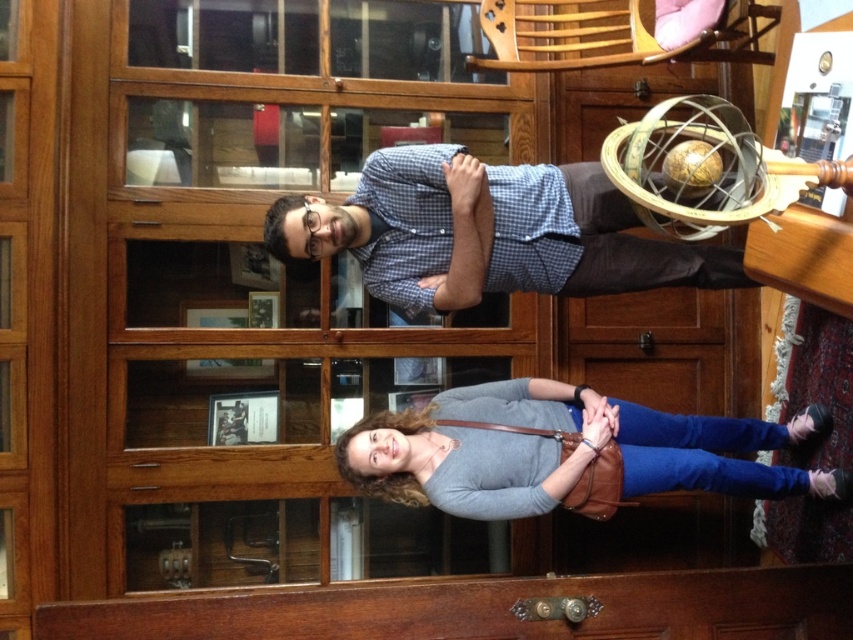
Which is behind, point (254, 381) or point (314, 243)?

Positioned behind is point (254, 381).

Does transparent wood glass door at upper center have a lesser height compared to blue checkered shirt at center?

In fact, transparent wood glass door at upper center may be taller than blue checkered shirt at center.

Is point (517, 362) closer to viewer compared to point (498, 273)?

No, (517, 362) is further to viewer.

Locate an element on the screen. transparent wood glass door at upper center is located at coordinates (260, 294).

The height and width of the screenshot is (640, 853). Find the location of `transparent wood glass door at upper center`. transparent wood glass door at upper center is located at coordinates (260, 294).

Can you confirm if transparent wood glass door at upper center is thinner than matte gray sweater at lower center?

Incorrect, transparent wood glass door at upper center's width is not less than matte gray sweater at lower center's.

Identify the location of transparent wood glass door at upper center. The image size is (853, 640). (260, 294).

Which is behind, point (276, 252) or point (474, 515)?

The point (474, 515) is more distant.

Locate an element on the screen. blue checkered shirt at center is located at coordinates (488, 232).

Identify the location of blue checkered shirt at center. (x=488, y=232).